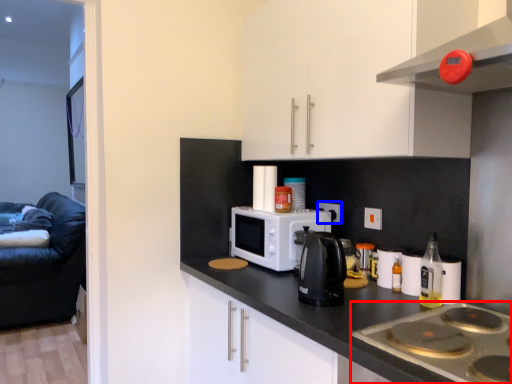
Question: Which point is closer to the camera, gas stove (highlighted by a red box) or electric outlet (highlighted by a blue box)?

Choices:
 (A) gas stove
 (B) electric outlet

Answer: (A)